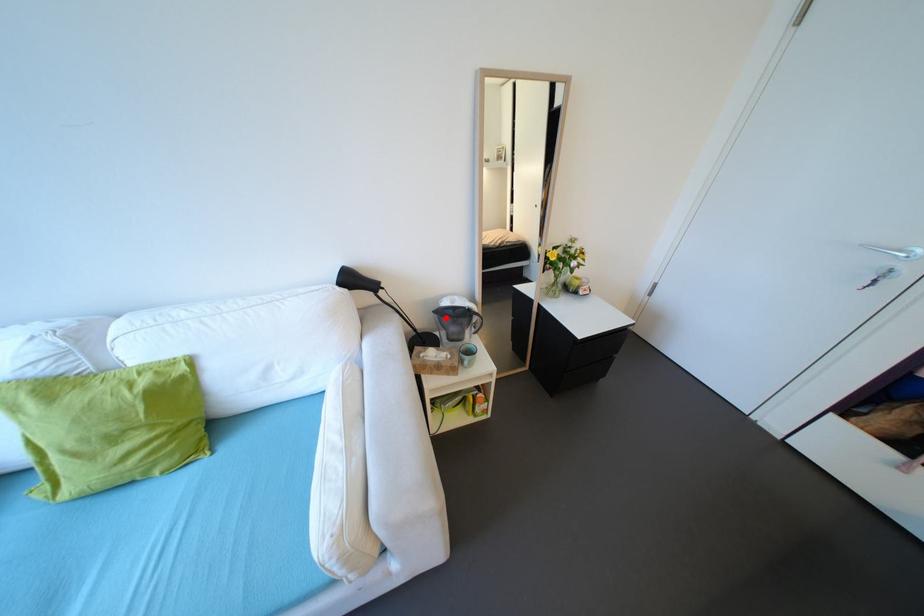
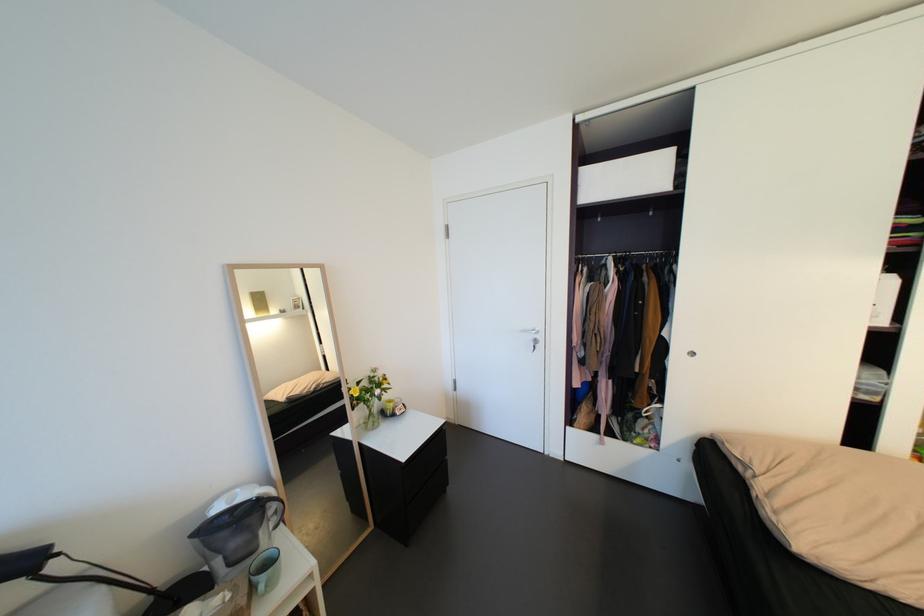
Where in the second image is the point corresponding to the highlighted location from the first image?

(210, 541)